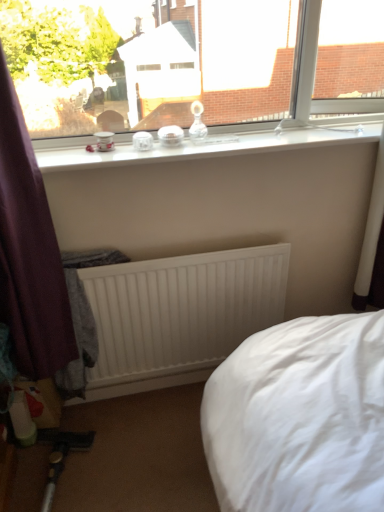
Question: Is clear glass jars at upper center closer to the viewer compared to transparent glass window at upper center?

Choices:
 (A) yes
 (B) no

Answer: (B)

Question: Can you confirm if clear glass jars at upper center is positioned to the right of transparent glass window at upper center?

Choices:
 (A) no
 (B) yes

Answer: (B)

Question: Is the depth of clear glass jars at upper center greater than that of transparent glass window at upper center?

Choices:
 (A) no
 (B) yes

Answer: (B)

Question: From a real-world perspective, is clear glass jars at upper center under transparent glass window at upper center?

Choices:
 (A) yes
 (B) no

Answer: (A)

Question: Are clear glass jars at upper center and transparent glass window at upper center far apart?

Choices:
 (A) yes
 (B) no

Answer: (B)

Question: Considering their positions, is clear glass jars at upper center located in front of or behind transparent glass window at upper center?

Choices:
 (A) behind
 (B) front

Answer: (A)

Question: Based on their sizes in the image, would you say clear glass jars at upper center is bigger or smaller than transparent glass window at upper center?

Choices:
 (A) small
 (B) big

Answer: (A)

Question: Is clear glass jars at upper center wider or thinner than transparent glass window at upper center?

Choices:
 (A) wide
 (B) thin

Answer: (A)

Question: Considering the positions of point (291, 134) and point (302, 74), is point (291, 134) closer or farther from the camera than point (302, 74)?

Choices:
 (A) closer
 (B) farther

Answer: (A)

Question: From the image's perspective, is transparent glass window at upper center located above or below white matte radiator at center?

Choices:
 (A) above
 (B) below

Answer: (A)

Question: Is transparent glass window at upper center to the left or to the right of white matte radiator at center in the image?

Choices:
 (A) left
 (B) right

Answer: (B)

Question: In the image, is transparent glass window at upper center positioned in front of or behind white matte radiator at center?

Choices:
 (A) front
 (B) behind

Answer: (A)

Question: Is transparent glass window at upper center inside the boundaries of white matte radiator at center, or outside?

Choices:
 (A) outside
 (B) inside

Answer: (A)

Question: Is point (185, 147) positioned closer to the camera than point (215, 262)?

Choices:
 (A) closer
 (B) farther

Answer: (A)

Question: In terms of width, does clear glass jars at upper center look wider or thinner when compared to white matte radiator at center?

Choices:
 (A) thin
 (B) wide

Answer: (B)